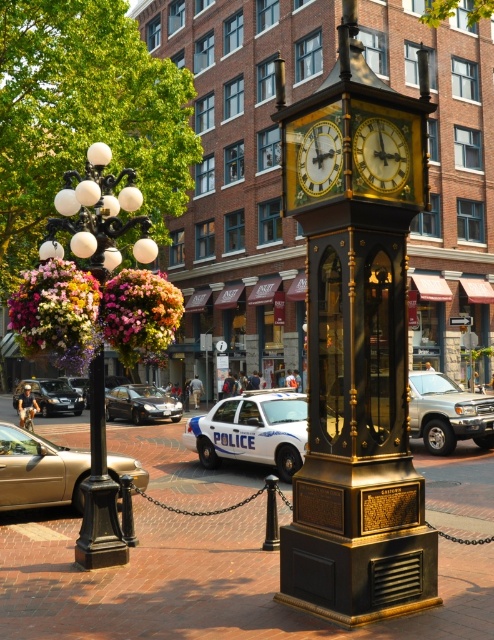
Which of these two, gold metallic car at lower left or gold/glass clock at center, stands taller?

gold metallic car at lower left is taller.

What do you see at coordinates (37, 468) in the screenshot? Image resolution: width=494 pixels, height=640 pixels. I see `gold metallic car at lower left` at bounding box center [37, 468].

At what (x,y) coordinates should I click in order to perform the action: click on gold metallic car at lower left. Please return your answer as a coordinate pair (x, y). The width and height of the screenshot is (494, 640). Looking at the image, I should click on (37, 468).

Can you confirm if brick pavement at center is wider than gold metallic car at lower left?

Yes.

Consider the image. Does brick pavement at center have a larger size compared to gold metallic car at lower left?

Yes, brick pavement at center is bigger than gold metallic car at lower left.

Between point (252, 468) and point (122, 468), which one is positioned in front?

Point (122, 468)

What are the coordinates of `brick pavement at center` in the screenshot? It's located at (200, 584).

Is point (388, 541) closer to viewer compared to point (138, 516)?

Yes, point (388, 541) is closer to viewer.

In the scene shown: Is gold polished metal clock at center above brick pavement at center?

Yes, gold polished metal clock at center is above brick pavement at center.

Does point (370, 458) come in front of point (180, 468)?

Yes, point (370, 458) is in front of point (180, 468).

Find the location of `gold polished metal clock at center`. gold polished metal clock at center is located at coordinates click(x=357, y=364).